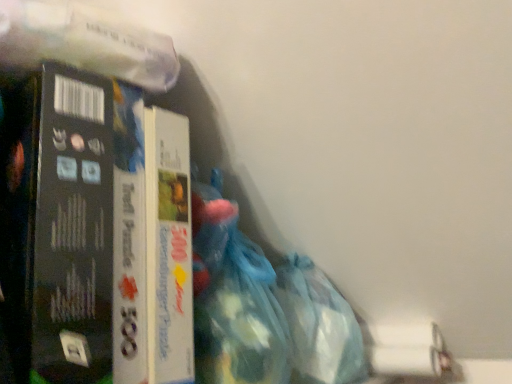
Find the location of a particular element. The width and height of the screenshot is (512, 384). translucent plastic bag at lower center is located at coordinates (233, 298).

Considering the sizes of matte cardboard puzzle box at left and translucent plastic bag at lower center in the image, is matte cardboard puzzle box at left wider or thinner than translucent plastic bag at lower center?

In the image, matte cardboard puzzle box at left appears to be wider than translucent plastic bag at lower center.

From the picture: Considering the relative sizes of matte cardboard puzzle box at left and translucent plastic bag at lower center in the image provided, is matte cardboard puzzle box at left smaller than translucent plastic bag at lower center?

Actually, matte cardboard puzzle box at left might be larger than translucent plastic bag at lower center.

Which is more to the left, matte cardboard puzzle box at left or translucent plastic bag at lower center?

From the viewer's perspective, matte cardboard puzzle box at left appears more on the left side.

From the image's perspective, is matte cardboard puzzle box at left located above or below translucent plastic bag at lower center?

Based on their image positions, matte cardboard puzzle box at left is located above translucent plastic bag at lower center.

In the scene shown: Can we say translucent blue plastic bag at lower right lies outside matte cardboard puzzle box at left?

translucent blue plastic bag at lower right is positioned outside matte cardboard puzzle box at left.

Find the location of a particular element. The width and height of the screenshot is (512, 384). book that appears on the left of translucent blue plastic bag at lower right is located at coordinates (62, 218).

From the image's perspective, between translucent blue plastic bag at lower right and matte cardboard puzzle box at left, which one is located above?

matte cardboard puzzle box at left is shown above in the image.

Considering the sizes of objects translucent blue plastic bag at lower right and matte cardboard puzzle box at left in the image provided, who is smaller, translucent blue plastic bag at lower right or matte cardboard puzzle box at left?

translucent blue plastic bag at lower right is smaller.

Is matte cardboard puzzle box at left surrounded by translucent plastic bag at lower center?

No, translucent plastic bag at lower center does not contain matte cardboard puzzle box at left.

From the picture: Is translucent plastic bag at lower center facing towards matte cardboard puzzle box at left?

No, translucent plastic bag at lower center is not oriented towards matte cardboard puzzle box at left.

Considering the positions of points (226, 204) and (47, 158), is point (226, 204) farther from camera compared to point (47, 158)?

Yes, point (226, 204) is farther from viewer.

How distant is translucent plastic bag at lower center from matte cardboard puzzle box at left?

A distance of 17.86 centimeters exists between translucent plastic bag at lower center and matte cardboard puzzle box at left.

Considering the points (60, 201) and (330, 327), which point is behind, point (60, 201) or point (330, 327)?

The point (330, 327) is behind.

Can you tell me how much matte cardboard puzzle box at left and translucent blue plastic bag at lower right differ in facing direction?

0.00166 degrees.

Is matte cardboard puzzle box at left spatially inside translucent blue plastic bag at lower right, or outside of it?

matte cardboard puzzle box at left cannot be found inside translucent blue plastic bag at lower right.

Between matte cardboard puzzle box at left and translucent blue plastic bag at lower right, which one appears on the right side from the viewer's perspective?

Positioned to the right is translucent blue plastic bag at lower right.

From the image's perspective, which one is positioned lower, translucent plastic bag at lower center or translucent blue plastic bag at lower right?

translucent blue plastic bag at lower right appears lower in the image.

Is translucent plastic bag at lower center aimed at translucent blue plastic bag at lower right?

No, translucent plastic bag at lower center is not turned towards translucent blue plastic bag at lower right.

How different are the orientations of translucent plastic bag at lower center and translucent blue plastic bag at lower right in degrees?

The angular difference between translucent plastic bag at lower center and translucent blue plastic bag at lower right is 0.00129 degrees.

Does point (216, 274) come behind point (313, 325)?

That is False.

Is translucent blue plastic bag at lower right looking in the opposite direction of translucent plastic bag at lower center?

No, translucent blue plastic bag at lower right's orientation is not away from translucent plastic bag at lower center.

Considering the positions of objects translucent blue plastic bag at lower right and translucent plastic bag at lower center in the image provided, who is more to the left, translucent blue plastic bag at lower right or translucent plastic bag at lower center?

translucent plastic bag at lower center.

Which object is closer to the camera, translucent blue plastic bag at lower right or translucent plastic bag at lower center?

translucent plastic bag at lower center is closer to the camera.

Does point (309, 334) lie in front of point (203, 322)?

No.

At what (x,y) coordinates should I click in order to perform the action: click on book in front of the translucent plastic bag at lower center. Please return your answer as a coordinate pair (x, y). This screenshot has height=384, width=512. Looking at the image, I should click on (62, 218).

In order to click on plastic bag below the matte cardboard puzzle box at left (from a real-world perspective) in this screenshot , I will do `click(319, 325)`.

Estimate the real-world distances between objects in this image. Which object is further from translucent plastic bag at lower center, matte cardboard puzzle box at left or translucent blue plastic bag at lower right?

Among the two, matte cardboard puzzle box at left is located further to translucent plastic bag at lower center.

Estimate the real-world distances between objects in this image. Which object is further from translucent blue plastic bag at lower right, matte cardboard puzzle box at left or translucent plastic bag at lower center?

matte cardboard puzzle box at left is positioned further to the anchor translucent blue plastic bag at lower right.

Considering their positions, is translucent plastic bag at lower center positioned closer to matte cardboard puzzle box at left than translucent blue plastic bag at lower right?

translucent plastic bag at lower center.

Based on their spatial positions, is translucent blue plastic bag at lower right or translucent plastic bag at lower center closer to matte cardboard puzzle box at left?

translucent plastic bag at lower center lies closer to matte cardboard puzzle box at left than the other object.

Looking at this image, which object lies nearer to the anchor point translucent plastic bag at lower center, translucent blue plastic bag at lower right or matte cardboard puzzle box at left?

translucent blue plastic bag at lower right lies closer to translucent plastic bag at lower center than the other object.

Which object lies further to the anchor point translucent blue plastic bag at lower right, translucent plastic bag at lower center or matte cardboard puzzle box at left?

The object further to translucent blue plastic bag at lower right is matte cardboard puzzle box at left.

Find the location of a particular element. The image size is (512, 384). waste between matte cardboard puzzle box at left and translucent blue plastic bag at lower right along the z-axis is located at coordinates (233, 298).